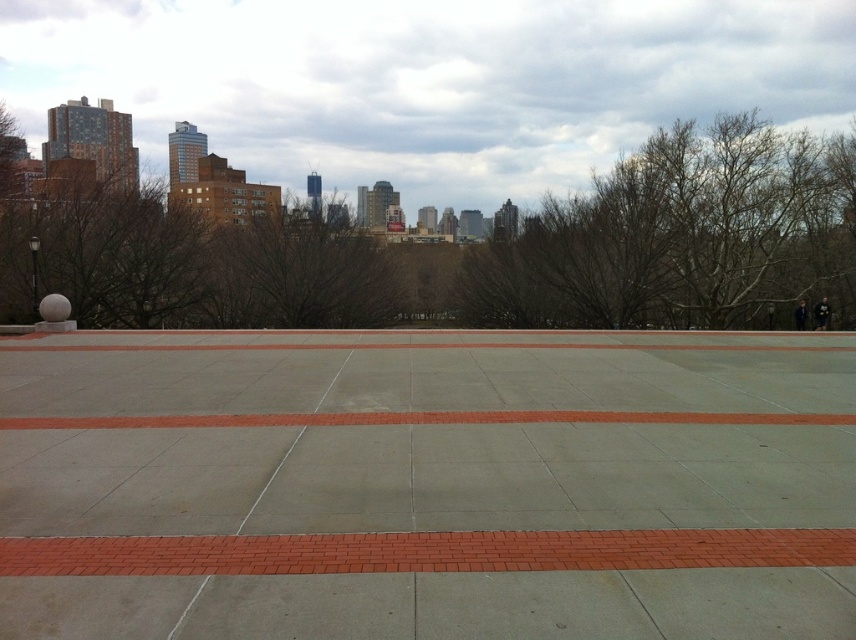
What do you see at coordinates (100, 257) in the screenshot? The width and height of the screenshot is (856, 640). I see `brown leafless tree at left` at bounding box center [100, 257].

Looking at this image, can you confirm if brown leafless tree at left is positioned to the left of brown leafless tree at center?

Indeed, brown leafless tree at left is positioned on the left side of brown leafless tree at center.

The height and width of the screenshot is (640, 856). In order to click on brown leafless tree at left in this screenshot , I will do `click(100, 257)`.

Where is `brown leafless tree at left`? The height and width of the screenshot is (640, 856). brown leafless tree at left is located at coordinates (100, 257).

Between bare branches at right and brown leafless tree at center, which one has less height?

With less height is brown leafless tree at center.

Can you confirm if bare branches at right is positioned above brown leafless tree at center?

Yes, bare branches at right is above brown leafless tree at center.

You are a GUI agent. You are given a task and a screenshot of the screen. Output one action in this format:
    pyautogui.click(x=<x>, y=<y>)
    Task: Click on the bare branches at right
    The image size is (856, 640).
    Given the screenshot: What is the action you would take?
    pyautogui.click(x=678, y=236)

Is point (833, 227) more distant than point (21, 216)?

Yes, point (833, 227) is behind point (21, 216).

Who is positioned more to the right, bare branches at right or brown leafless tree at left?

Positioned to the right is bare branches at right.

Who is more distant from viewer, (728, 323) or (21, 284)?

The point (728, 323) is behind.

The height and width of the screenshot is (640, 856). Find the location of `bare branches at right`. bare branches at right is located at coordinates (678, 236).